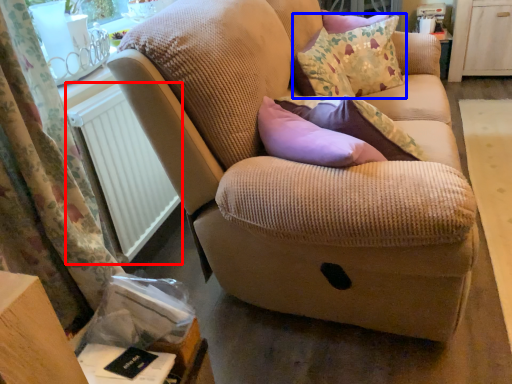
Question: Which object appears closest to the camera in this image, radiator (highlighted by a red box) or throw pillow (highlighted by a blue box)?

Choices:
 (A) radiator
 (B) throw pillow

Answer: (A)